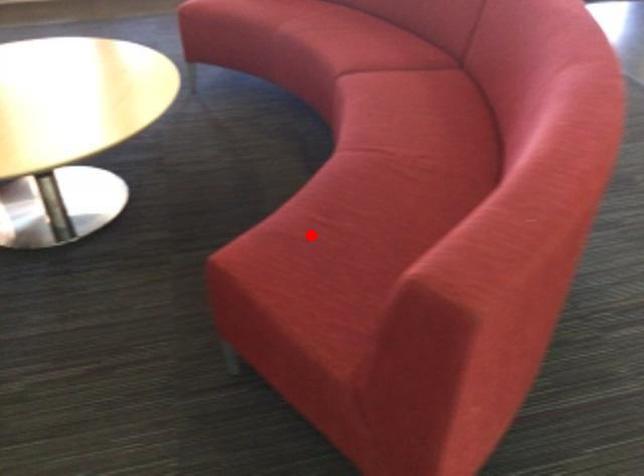
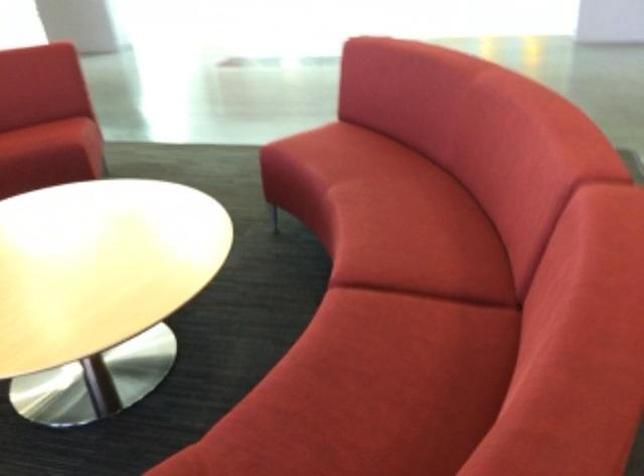
Find the pixel in the second image that matches the highlighted location in the first image.

(46, 136)